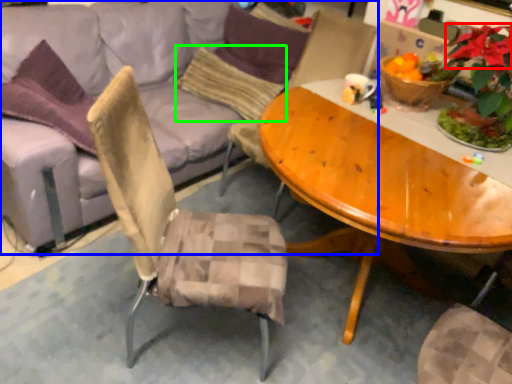
Question: Estimate the real-world distances between objects in this image. Which object is farther from flower (highlighted by a red box), studio couch (highlighted by a blue box) or pillow (highlighted by a green box)?

Choices:
 (A) studio couch
 (B) pillow

Answer: (A)